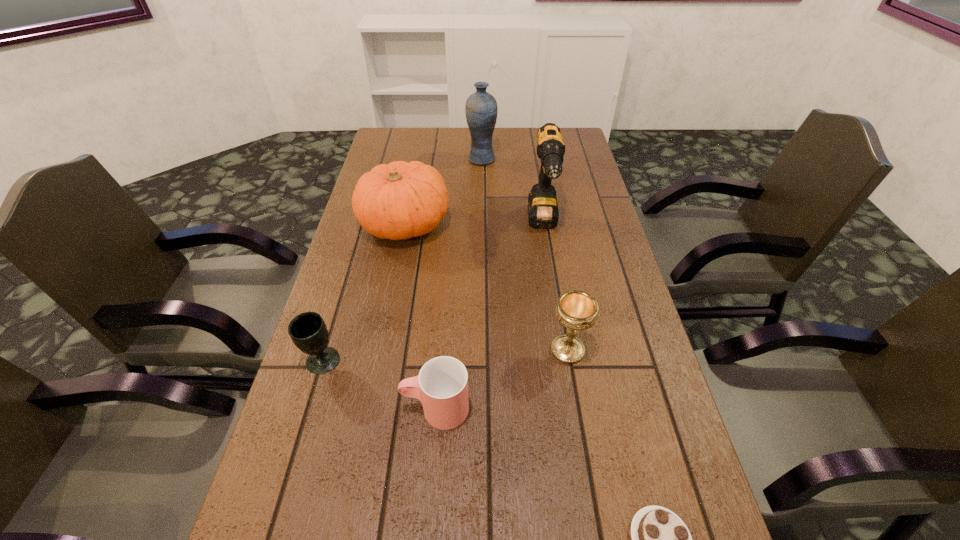
This screenshot has height=540, width=960. I want to click on free spot at the left edge of the desktop, so click(x=274, y=486).

In order to click on vacant space at the right edge of the desktop in this screenshot , I will do `click(586, 172)`.

At what (x,y) coordinates should I click in order to perform the action: click on free location at the far right corner. Please return your answer as a coordinate pair (x, y). The image size is (960, 540). Looking at the image, I should click on (573, 141).

In order to click on blank region between the right chalice and the third nearest object in this screenshot , I will do `click(502, 380)`.

What are the coordinates of `free area in between the drill and the third nearest object` in the screenshot? It's located at (490, 316).

The width and height of the screenshot is (960, 540). Find the location of `free spot between the shorter chalice and the pumpkin`. free spot between the shorter chalice and the pumpkin is located at coordinates (364, 293).

Identify the location of free spot between the third nearest object and the pumpkin. The image size is (960, 540). (420, 316).

Where is `free spot between the left chalice and the pumpkin`? The image size is (960, 540). free spot between the left chalice and the pumpkin is located at coordinates (364, 293).

This screenshot has height=540, width=960. I want to click on empty location between the shorter chalice and the farthest object, so click(x=402, y=260).

Identify the location of object that ranks as the third closest to the left chalice. Image resolution: width=960 pixels, height=540 pixels. (415, 539).